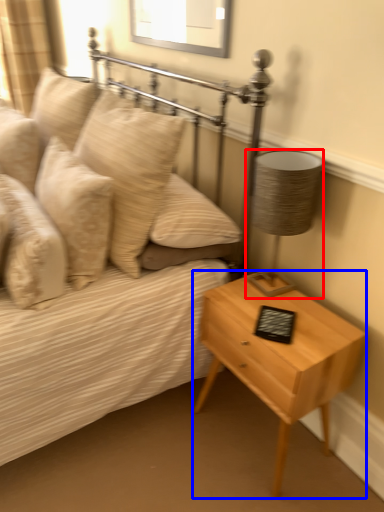
Question: Which object is further to the camera taking this photo, lamp (highlighted by a red box) or nightstand (highlighted by a blue box)?

Choices:
 (A) lamp
 (B) nightstand

Answer: (A)